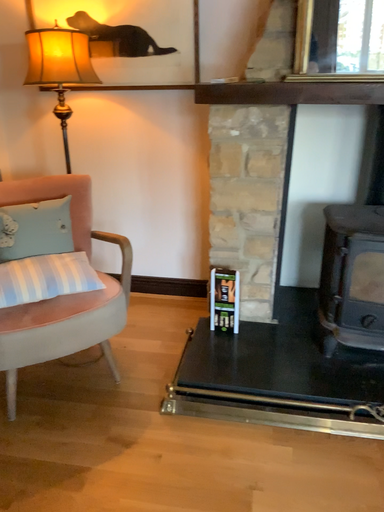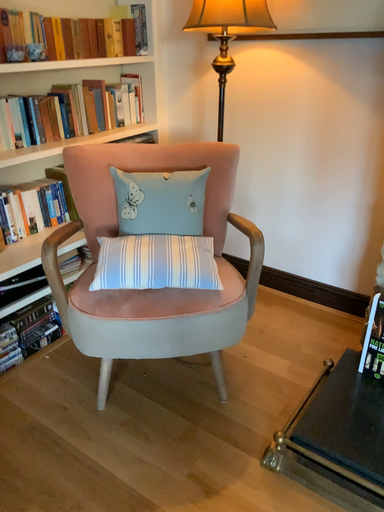
Question: How did the camera likely rotate when shooting the video?

Choices:
 (A) rotated right
 (B) rotated left

Answer: (B)